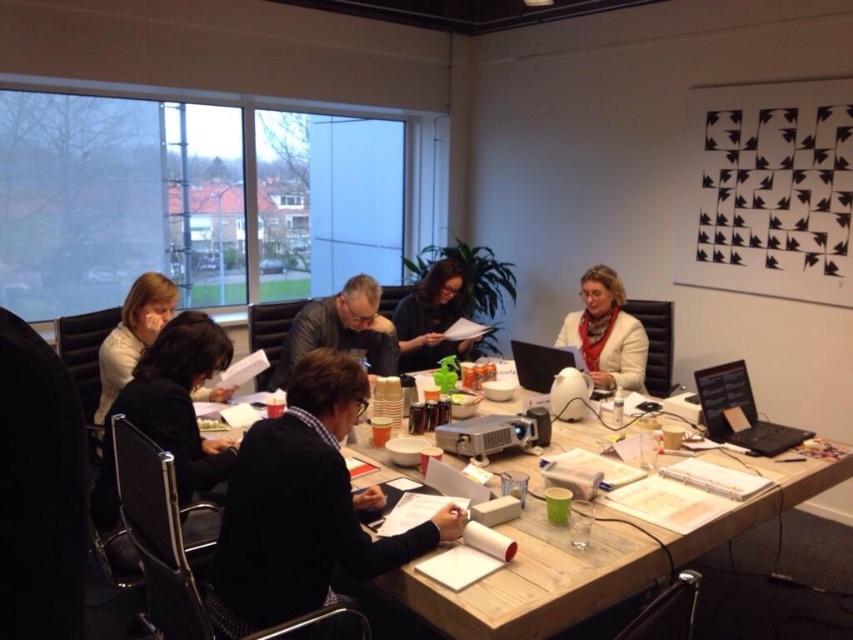
Question: Is wooden table at center thinner than white matte jacket at upper left?

Choices:
 (A) yes
 (B) no

Answer: (B)

Question: Which object is closer to the camera taking this photo?

Choices:
 (A) black fabric jacket at lower left
 (B) white matte jacket at upper left
 (C) black matte sweater at center

Answer: (C)

Question: Does black fabric jacket at lower left have a lesser width compared to black plastic laptop at lower right?

Choices:
 (A) yes
 (B) no

Answer: (A)

Question: Which point is closer to the camera?

Choices:
 (A) black matte sweater at center
 (B) matte black jacket at center
 (C) white matte jacket at upper left

Answer: (A)

Question: Does wooden table at center have a lesser width compared to black matte sweater at center?

Choices:
 (A) yes
 (B) no

Answer: (B)

Question: Which object is positioned closest to the wooden table at center?

Choices:
 (A) white leather jacket at center
 (B) black plastic laptop at lower right
 (C) satin black laptop at center

Answer: (B)